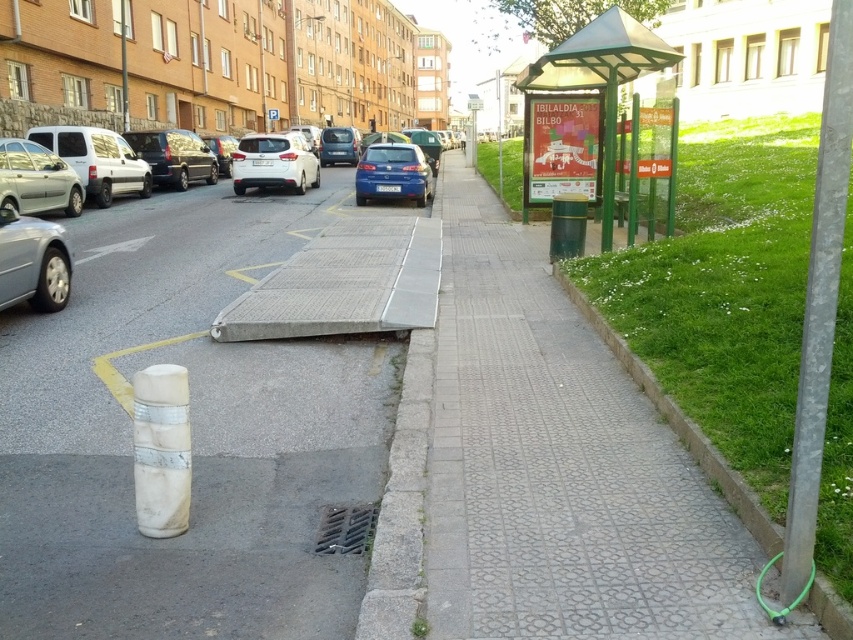
Which is behind, point (26, 196) or point (361, 198)?

Positioned behind is point (361, 198).

Looking at this image, between metallic silver car at left and matte blue hatchback at center, which one is positioned lower?

metallic silver car at left is below.

I want to click on metallic silver car at left, so click(x=36, y=179).

Which is above, silver metallic pole at right or silver metallic car at left?

silver metallic car at left is above.

Does point (788, 534) lie behind point (16, 266)?

No, it is not.

Where is `silver metallic pole at right`? The height and width of the screenshot is (640, 853). silver metallic pole at right is located at coordinates coord(819,304).

Measure the distance from satin white suv at center to white plastic parking sign at upper center.

They are 9.26 meters apart.

Can you confirm if satin white suv at center is smaller than white plastic parking sign at upper center?

No, satin white suv at center is not smaller than white plastic parking sign at upper center.

I want to click on satin white suv at center, so click(273, 163).

You are a GUI agent. You are given a task and a screenshot of the screen. Output one action in this format:
    pyautogui.click(x=<x>, y=<y>)
    Task: Click on the satin white suv at center
    Image resolution: width=853 pixels, height=640 pixels.
    Given the screenshot: What is the action you would take?
    click(273, 163)